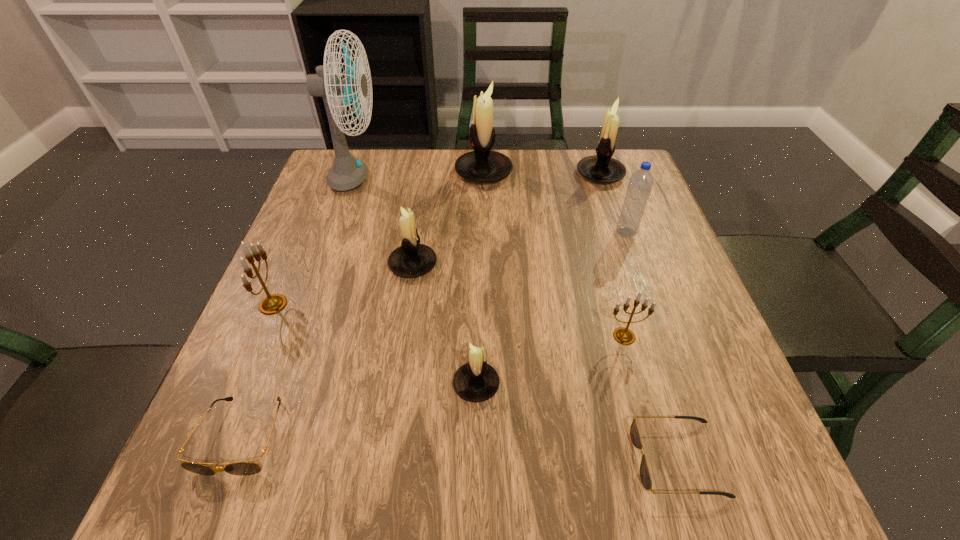
I want to click on the tallest object, so [346, 173].

Image resolution: width=960 pixels, height=540 pixels. What are the coordinates of `gray fan` in the screenshot? It's located at (346, 173).

The image size is (960, 540). Identify the location of the tallest candle holder. (482, 165).

Identify the location of the second tallest object. (482, 165).

Identify the location of the fifth shortest candle holder. (601, 168).

At what (x,y) coordinates should I click in order to perform the action: click on the rightmost white candle holder. Please return your answer as a coordinate pair (x, y). Looking at the image, I should click on (601, 168).

Identify the location of blue water bottle. (640, 184).

Where is `the fourth farthest object`? The width and height of the screenshot is (960, 540). the fourth farthest object is located at coordinates (640, 184).

Where is `the second candle holder from left to right`? The height and width of the screenshot is (540, 960). the second candle holder from left to right is located at coordinates (412, 259).

Identify the location of the fifth farthest object. The image size is (960, 540). (412, 259).